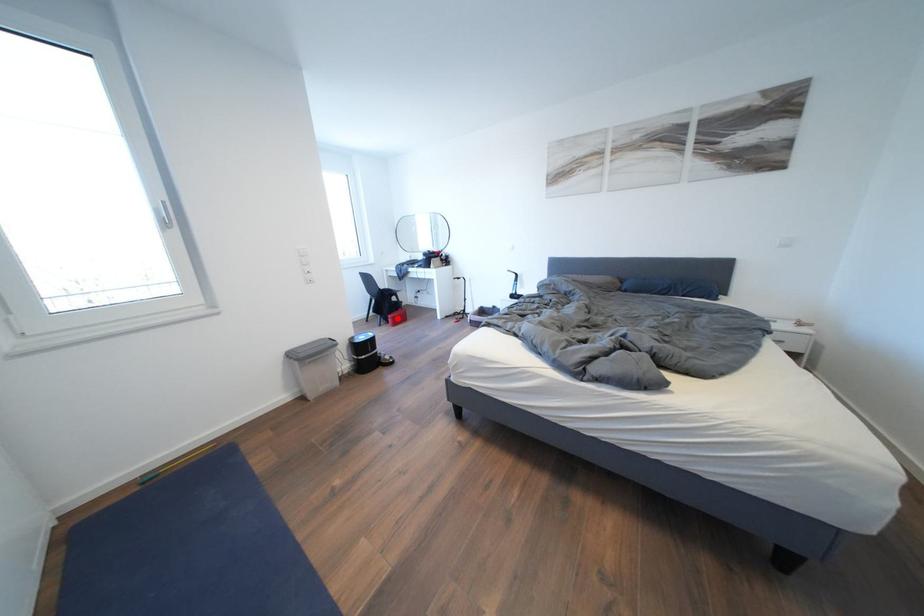
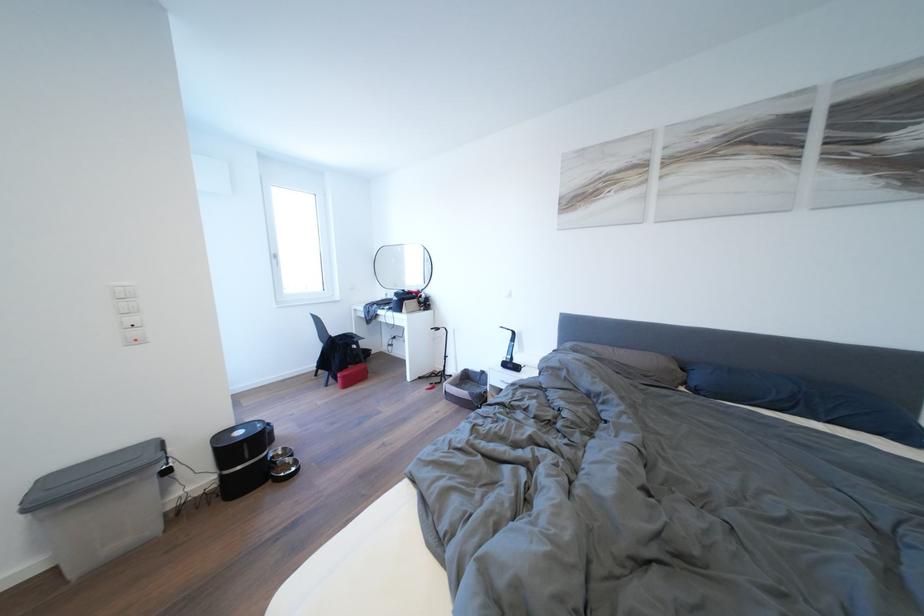
The point at the highlighted location is marked in the first image. Where is the corresponding point in the second image?

(348, 376)